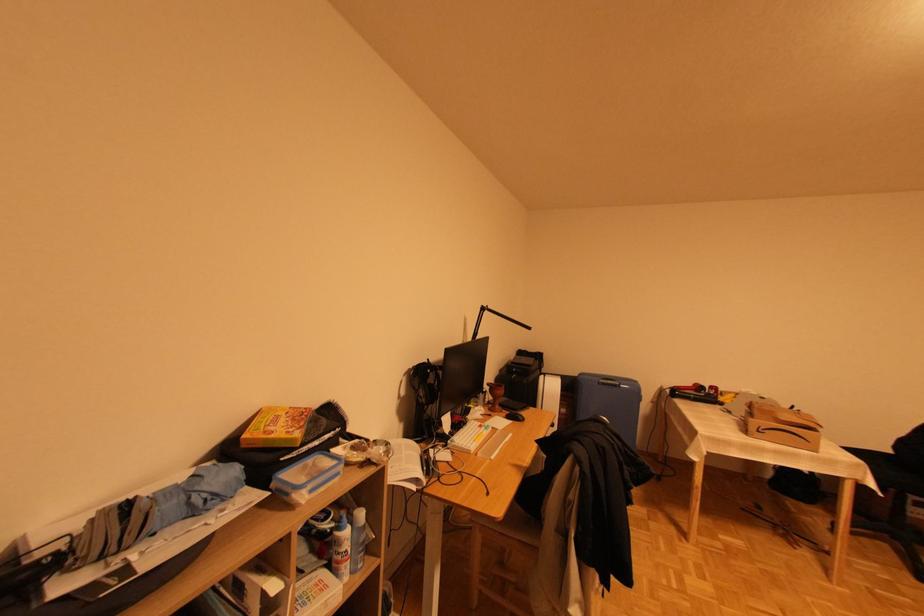
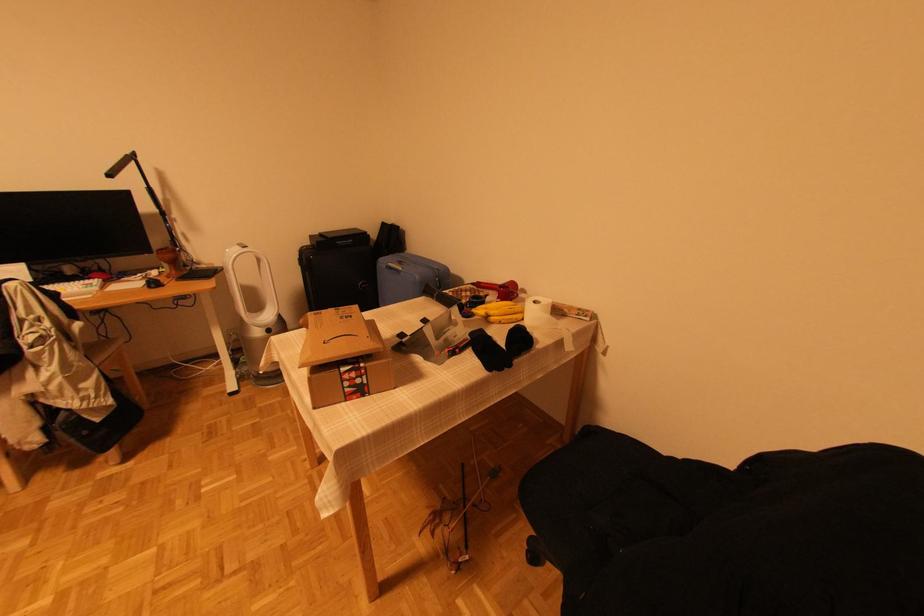
The point at [746,509] is marked in the first image. Where is the corresponding point in the second image?

(466, 466)